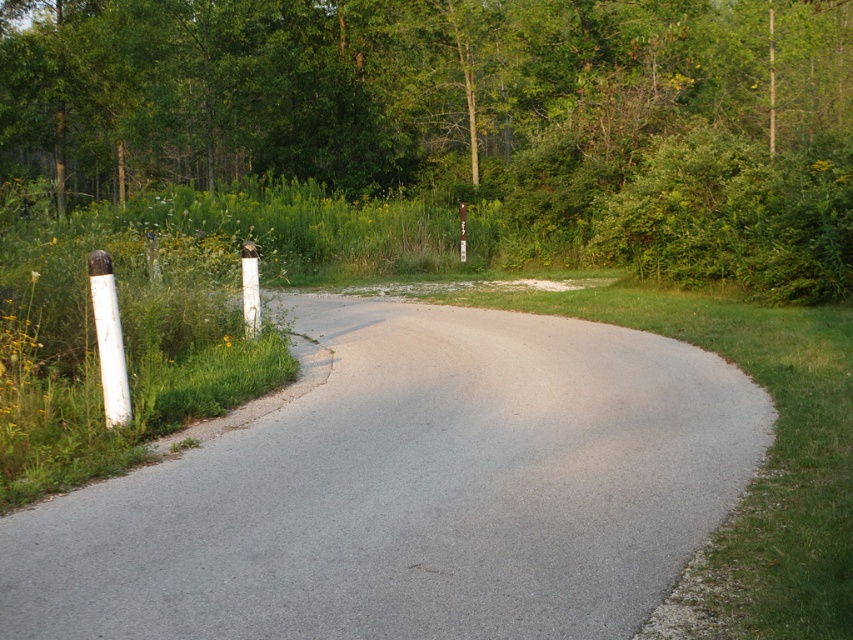
Between green leafy tree at upper center and gray asphalt road at center, which one has more height?

green leafy tree at upper center is taller.

Is green leafy tree at upper center thinner than gray asphalt road at center?

No, green leafy tree at upper center is not thinner than gray asphalt road at center.

Is point (498, 67) more distant than point (511, 433)?

Yes, it is.

Where is `green leafy tree at upper center`? green leafy tree at upper center is located at coordinates (469, 116).

Does point (300, 490) come in front of point (105, 352)?

Yes.

Which is more to the right, gray asphalt road at center or white painted wood post at left?

Positioned to the right is gray asphalt road at center.

Which is in front, point (538, 605) or point (114, 422)?

Point (538, 605) is more forward.

I want to click on gray asphalt road at center, so click(x=410, y=492).

Which is more to the right, green leafy tree at upper center or white painted wood post at left?

white painted wood post at left

Is green leafy tree at upper center wider than white painted wood post at left?

Yes.

Does point (363, 113) come in front of point (122, 362)?

That is False.

This screenshot has height=640, width=853. I want to click on green leafy tree at upper center, so click(469, 116).